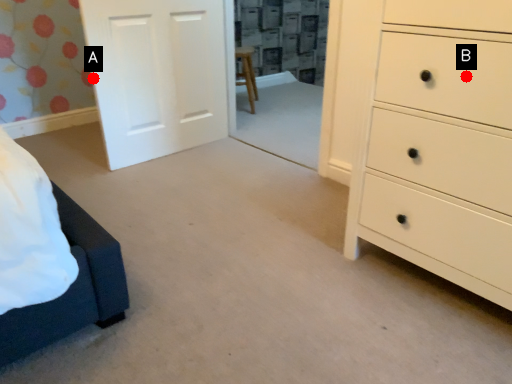
Question: Two points are circled on the image, labeled by A and B beside each circle. Which point appears farthest from the camera in this image?

Choices:
 (A) A is further
 (B) B is further

Answer: (A)